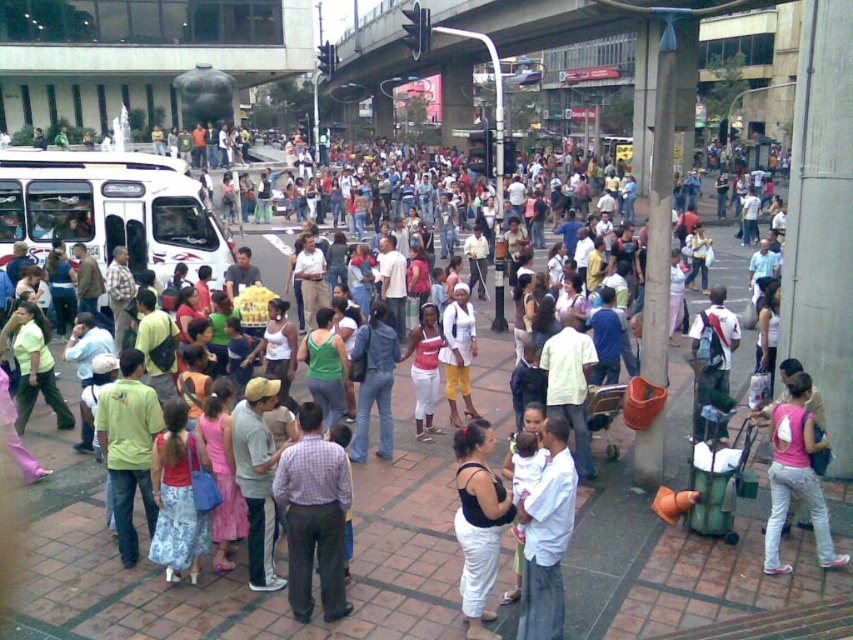
Question: Does matte black tank top at center lie in front of pink fabric bag at center?

Choices:
 (A) no
 (B) yes

Answer: (B)

Question: Among these objects, which one is farthest from the camera?

Choices:
 (A) plaid shirt at center
 (B) white cotton shirt at center

Answer: (A)

Question: Which of the following is the closest to the observer?

Choices:
 (A) plaid shirt at center
 (B) matte pink tank top at center

Answer: (A)

Question: Considering the real-world distances, which object is farthest from the white cotton shirt at center?

Choices:
 (A) matte pink tank top at center
 (B) white backpack at center

Answer: (A)

Question: Observing the image, what is the correct spatial positioning of plaid shirt at center in reference to white backpack at center?

Choices:
 (A) above
 (B) below

Answer: (B)

Question: Does matte black tank top at center appear on the left side of matte pink tank top at center?

Choices:
 (A) yes
 (B) no

Answer: (B)